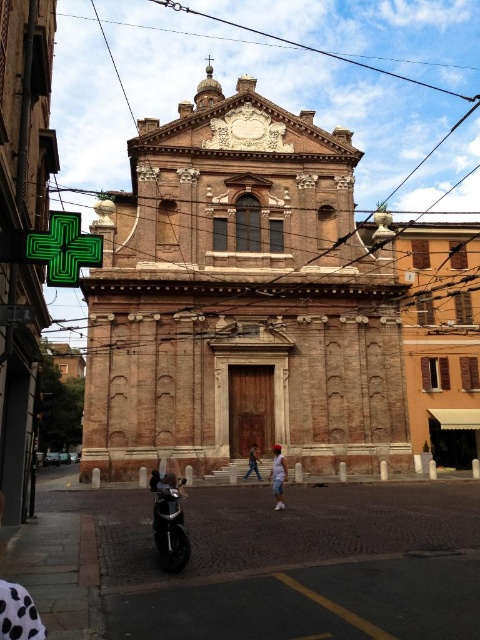
You are a delivery person who needs to park your shiny black motorcycle at center in a parking spot that can only accommodate vehicles narrower than the light blue denim shorts at center. Can your motorcycle fit in the spot?

The shiny black motorcycle at center is wider than the light blue denim shorts at center, so it cannot fit in the parking spot designed for narrower vehicles.

You are a delivery person who needs to park your shiny black motorcycle at center near the historic building. The parking area is a rectangle from point A at lower left corner to point B at upper right corner. The coordinates of point A are at 0.6, 0.6 and point B at 0.9, 0.4. Is your motorcycle within the parking area?

The shiny black motorcycle at center is located at point (168, 522). The parking area spans from point A at (288, 384) to point B at (192, 576). Since the motorcycle is at 0.817 in the x coordinate between 0.6 and 0.9, but its y coordinate 0.352 is below the lower y coordinate of 0.4, it is outside the parking area.

You are a photographer planning to take a photo of the brown brick church at center and the light blue denim shorts at center in the historic building scene. Which object should you focus on first if you want to capture the tallest subject in the frame?

The brown brick church at center is taller than the light blue denim shorts at center, so you should focus on the brown brick church at center first to capture the tallest subject in the frame.